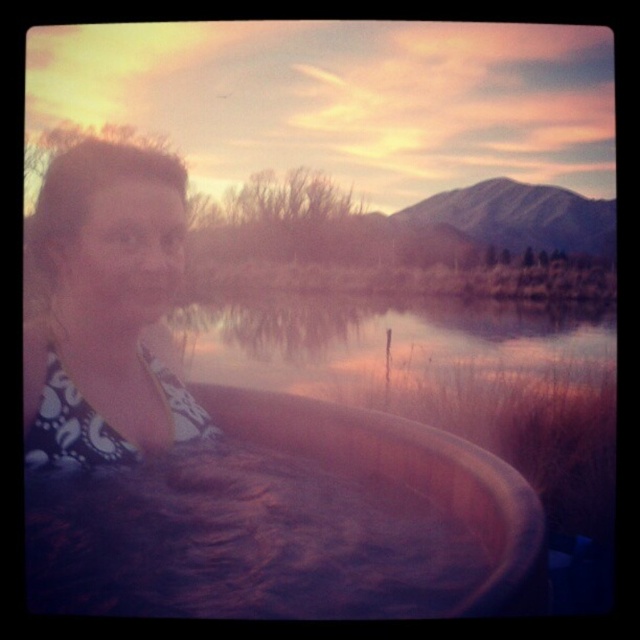
You are standing at the edge of the water and want to reach the brown wooden tub at lower center. According to the coordinates provided, in which direction should you move relative to your current position?

The brown wooden tub at lower center is located at coordinates point (291, 522). Since you are at the edge of the water, you should move towards the center and slightly to the right to reach it.

You are a lifeguard standing at the edge of the water. You need to reach the person wearing the matte black bikini top at left from the transparent water at center. Can you do it without getting out of the water?

The distance between the matte black bikini top at left and the transparent water at center is 6.53 feet, so yes, you can reach the person without leaving the water as the distance is manageable while staying in the transparent water at center.

You are standing at the edge of the lake and see the brown wooden tub at lower center and the transparent water at center. Which object is closer to your left side?

The brown wooden tub at lower center is positioned on the left side of transparent water at center, so it is closer to your left side.